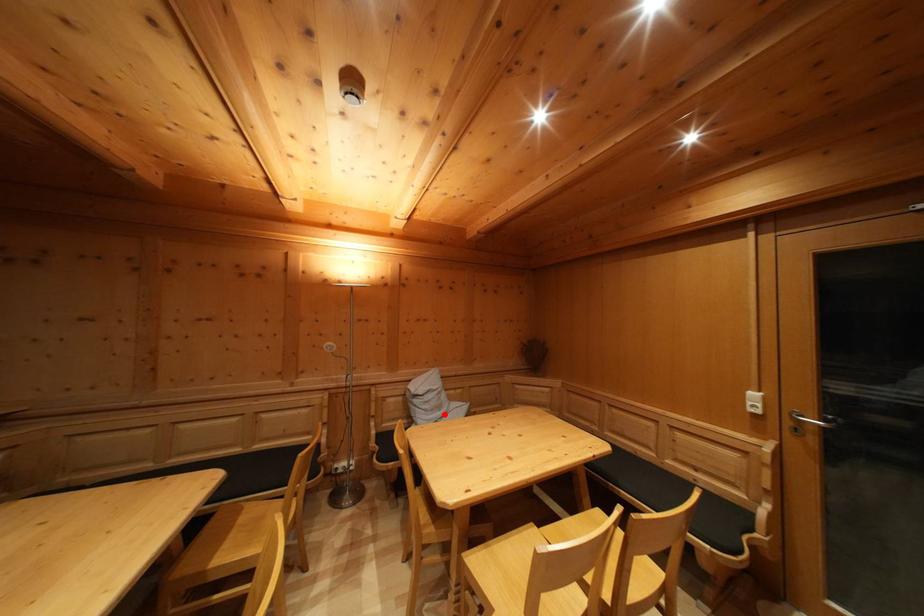
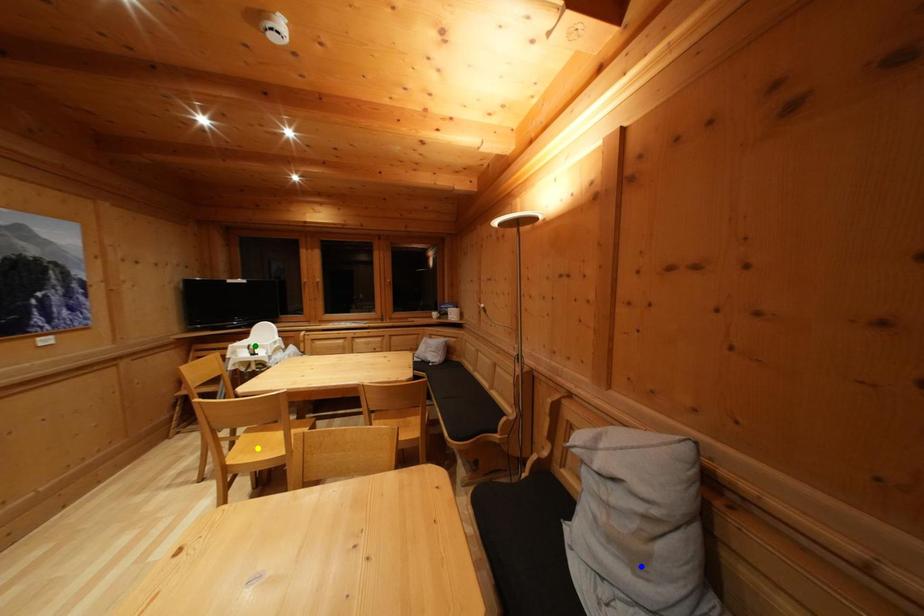
Question: I am providing you with two images of the same scene from different viewpoints. A red point is marked on the first image. You are given multiple points on the second image. Which mark in image 2 goes with the point in image 1?

Choices:
 (A) blue point
 (B) green point
 (C) yellow point

Answer: (A)